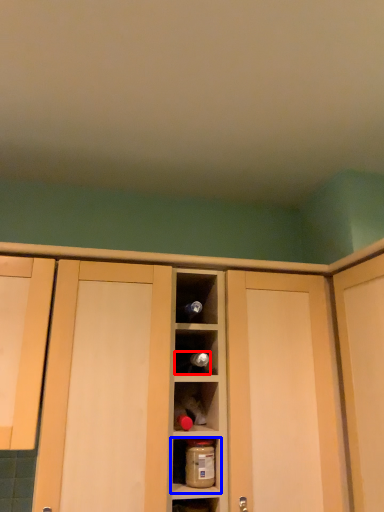
Question: Which object is further to the camera taking this photo, wine bottle (highlighted by a red box) or shelf (highlighted by a blue box)?

Choices:
 (A) wine bottle
 (B) shelf

Answer: (A)